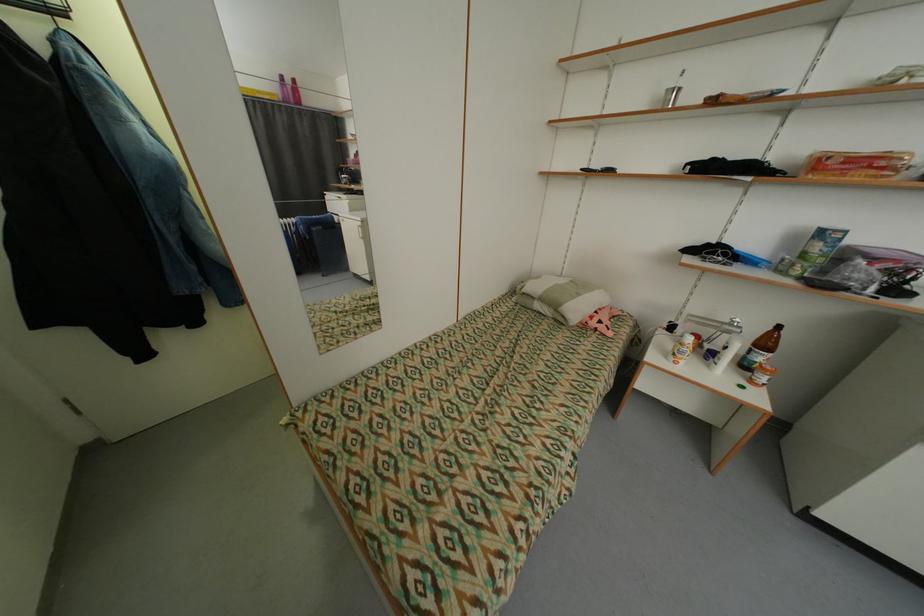
Find where to lift the orange lidded jar. Please return your answer as a coordinate pair (x, y).

(760, 349)